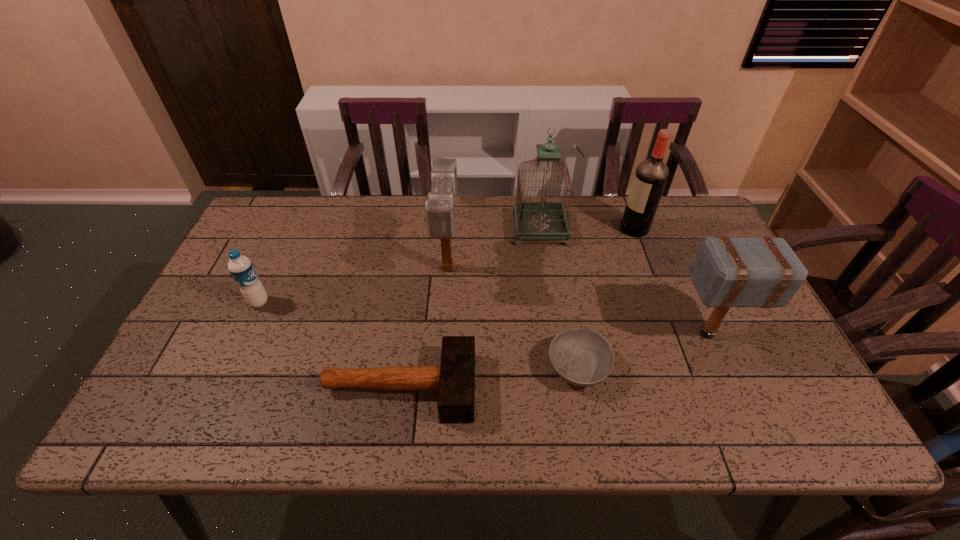
Where is `free spot between the birdcage and the rightmost mallet`? This screenshot has height=540, width=960. free spot between the birdcage and the rightmost mallet is located at coordinates (624, 281).

At what (x,y) coordinates should I click in order to perform the action: click on object that is the fourth closest one to the liquor. Please return your answer as a coordinate pair (x, y). The width and height of the screenshot is (960, 540). Looking at the image, I should click on (439, 208).

Locate which object ranks sixth in proximity to the fifth tallest object. Please provide its 2D coordinates. Your answer should be formatted as a tuple, i.e. [(x, y)], where the tuple contains the x and y coordinates of a point satisfying the conditions above.

[(764, 272)]

At what (x,y) coordinates should I click in order to perform the action: click on mallet that stands as the closest to the shortest mallet. Please return your answer as a coordinate pair (x, y). The width and height of the screenshot is (960, 540). Looking at the image, I should click on (439, 208).

Image resolution: width=960 pixels, height=540 pixels. In order to click on mallet that is the closest to the bowl in this screenshot , I will do `click(454, 379)`.

Find the location of a particular element. vacant position in the image that satisfies the following two spatial constraints: 1. on the front-facing side of the liquor; 2. on the front side of the shortest object is located at coordinates (687, 368).

Identify the location of vacant area that satisfies the following two spatial constraints: 1. on the label of the shortest object; 2. on the left side of the fifth tallest object. (228, 368).